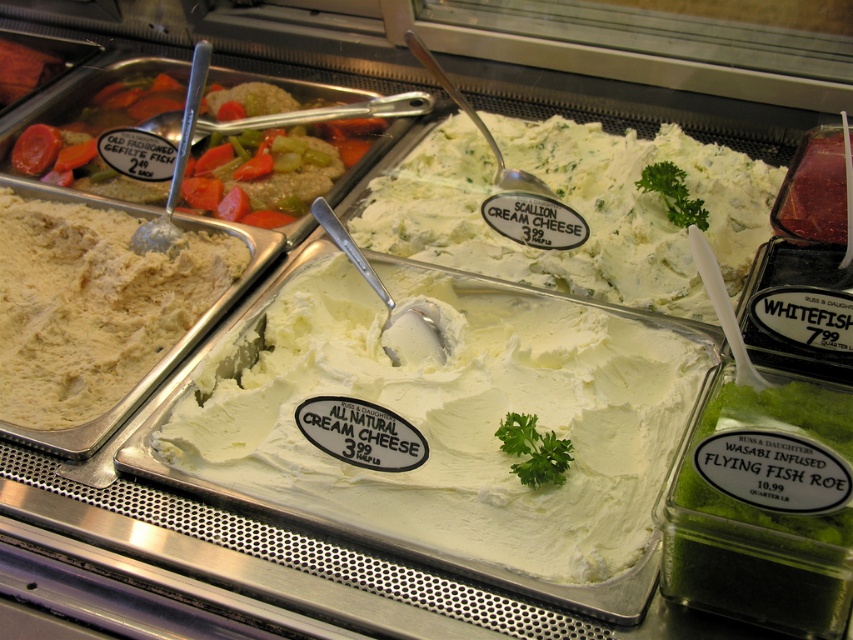
Question: Which of these objects is positioned closest to the white creamy cream cheese at center?

Choices:
 (A) old fashioned gefilte fish at upper left
 (B) white creamy spread at center

Answer: (B)

Question: Is white creamy cream cheese at center further to camera compared to old fashioned gefilte fish at upper left?

Choices:
 (A) no
 (B) yes

Answer: (A)

Question: Is white creamy cream cheese at center above old fashioned gefilte fish at upper left?

Choices:
 (A) yes
 (B) no

Answer: (B)

Question: Which point is closer to the camera?

Choices:
 (A) (523, 548)
 (B) (469, 248)
 (C) (229, 140)

Answer: (A)

Question: Does white creamy spread at center have a smaller size compared to old fashioned gefilte fish at upper left?

Choices:
 (A) no
 (B) yes

Answer: (B)

Question: Considering the real-world distances, which object is closest to the old fashioned gefilte fish at upper left?

Choices:
 (A) white creamy spread at center
 (B) white creamy cream cheese at center

Answer: (A)